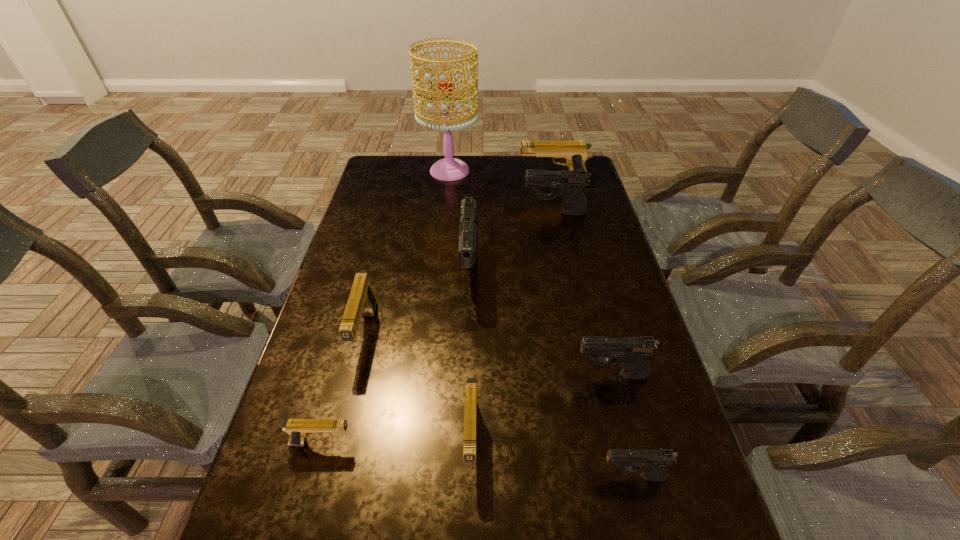
The height and width of the screenshot is (540, 960). I want to click on tan pistol that stands as the second closest to the shortest pistol, so click(x=470, y=412).

Where is `the third closest tan pistol relative to the smallest black pistol`? Image resolution: width=960 pixels, height=540 pixels. the third closest tan pistol relative to the smallest black pistol is located at coordinates (361, 300).

Where is `vacant position in the image that satisfies the following two spatial constraints: 1. at the barrel of the farthest black pistol; 2. at the barrel of the third nearest black pistol`? The image size is (960, 540). vacant position in the image that satisfies the following two spatial constraints: 1. at the barrel of the farthest black pistol; 2. at the barrel of the third nearest black pistol is located at coordinates (567, 272).

Where is `blank space that satisfies the following two spatial constraints: 1. at the barrel of the rightmost tan pistol; 2. at the barrel of the tallest pistol`? blank space that satisfies the following two spatial constraints: 1. at the barrel of the rightmost tan pistol; 2. at the barrel of the tallest pistol is located at coordinates (573, 272).